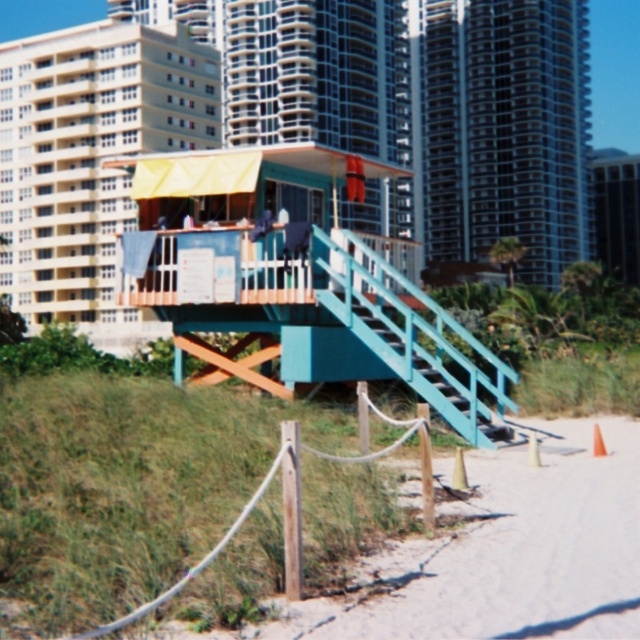
Question: Observing the image, what is the correct spatial positioning of teal wooden lifeguard tower at center in reference to teal painted wood stairs at center?

Choices:
 (A) below
 (B) above

Answer: (B)

Question: Which of the following is the farthest from the observer?

Choices:
 (A) teal wooden lifeguard tower at center
 (B) teal painted wood stairs at center

Answer: (B)

Question: Among these points, which one is nearest to the camera?

Choices:
 (A) (422, 342)
 (B) (408, 369)

Answer: (B)

Question: Among these points, which one is nearest to the camera?

Choices:
 (A) (438, 323)
 (B) (173, 211)

Answer: (A)

Question: Is teal wooden lifeguard tower at center positioned behind teal painted wood stairs at center?

Choices:
 (A) no
 (B) yes

Answer: (A)

Question: Is the position of teal wooden lifeguard tower at center more distant than that of teal painted wood stairs at center?

Choices:
 (A) no
 (B) yes

Answer: (A)